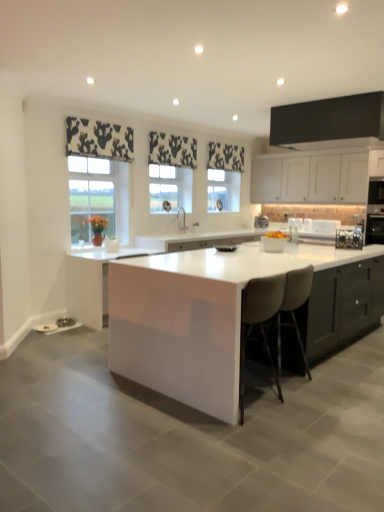
Question: In which direction should I rotate to look at metallic silver toaster at center, placed as the second appliance when sorted from left to right?

Choices:
 (A) right
 (B) left

Answer: (A)

Question: Considering the relative sizes of black stainless steel oven at right, the 3th appliance when ordered from front to back, and black floral fabric at upper center, acting as the second curtain starting from the left, in the image provided, is black stainless steel oven at right, the 3th appliance when ordered from front to back, bigger than black floral fabric at upper center, acting as the second curtain starting from the left,?

Choices:
 (A) no
 (B) yes

Answer: (B)

Question: Considering the relative sizes of black stainless steel oven at right, arranged as the third appliance when viewed from the left, and black floral fabric at upper center, which is the second curtain in front-to-back order, in the image provided, is black stainless steel oven at right, arranged as the third appliance when viewed from the left, taller than black floral fabric at upper center, which is the second curtain in front-to-back order,?

Choices:
 (A) yes
 (B) no

Answer: (A)

Question: From a real-world perspective, is black stainless steel oven at right, arranged as the third appliance when viewed from the left, physically below black floral fabric at upper center, which is the second curtain in front-to-back order?

Choices:
 (A) yes
 (B) no

Answer: (A)

Question: From a real-world perspective, does black stainless steel oven at right, arranged as the third appliance when viewed from the left, stand above black floral fabric at upper center, marked as the second curtain in a right-to-left arrangement?

Choices:
 (A) no
 (B) yes

Answer: (A)

Question: Can you confirm if black stainless steel oven at right, the 3th appliance when ordered from front to back, is shorter than black floral fabric at upper center, marked as the second curtain in a right-to-left arrangement?

Choices:
 (A) no
 (B) yes

Answer: (A)

Question: From the image's perspective, would you say black stainless steel oven at right, placed as the first appliance when sorted from right to left, is positioned over black floral fabric at upper center, acting as the second curtain starting from the left?

Choices:
 (A) yes
 (B) no

Answer: (B)

Question: Is the surface of white glossy bowl at center in direct contact with white glossy coffee machine at center?

Choices:
 (A) no
 (B) yes

Answer: (A)

Question: Can you confirm if white glossy bowl at center is smaller than white glossy coffee machine at center?

Choices:
 (A) no
 (B) yes

Answer: (B)

Question: From a real-world perspective, is white glossy bowl at center physically below white glossy coffee machine at center?

Choices:
 (A) no
 (B) yes

Answer: (A)

Question: Is white glossy bowl at center shorter than white glossy coffee machine at center?

Choices:
 (A) yes
 (B) no

Answer: (A)

Question: Is white glossy bowl at center not near white glossy coffee machine at center?

Choices:
 (A) yes
 (B) no

Answer: (B)

Question: Does white glossy bowl at center have a greater height compared to white glossy coffee machine at center?

Choices:
 (A) no
 (B) yes

Answer: (A)

Question: Does white glossy cabinet at center, positioned as the 2th cabinetry in front-to-back order, have a lesser height compared to white glossy bowl at center?

Choices:
 (A) yes
 (B) no

Answer: (B)